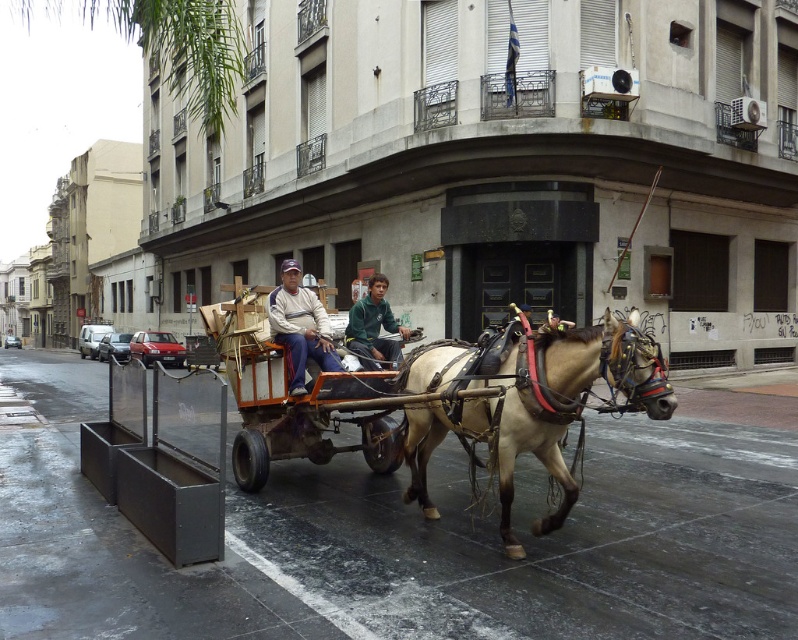
Question: Does light brown leather horse at center appear on the left side of green fuzzy jacket at center?

Choices:
 (A) yes
 (B) no

Answer: (B)

Question: Considering the real-world distances, which object is farthest from the light brown leather jacket at center?

Choices:
 (A) light brown leather horse at center
 (B) green fuzzy jacket at center

Answer: (A)

Question: Among these objects, which one is farthest from the camera?

Choices:
 (A) light brown leather jacket at center
 (B) green fuzzy jacket at center
 (C) light brown leather horse at center

Answer: (B)

Question: Among these objects, which one is farthest from the camera?

Choices:
 (A) light brown leather horse at center
 (B) green fuzzy jacket at center
 (C) light brown leather jacket at center

Answer: (B)

Question: Does light brown leather horse at center have a greater width compared to green fuzzy jacket at center?

Choices:
 (A) no
 (B) yes

Answer: (B)

Question: Does light brown leather horse at center appear over green fuzzy jacket at center?

Choices:
 (A) no
 (B) yes

Answer: (A)